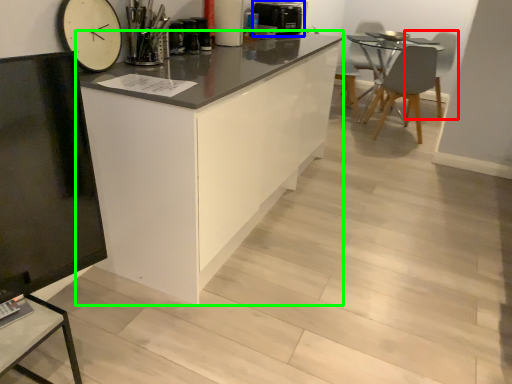
Question: Estimate the real-world distances between objects in this image. Which object is closer to swivel chair (highlighted by a red box), appliance (highlighted by a blue box) or cabinetry (highlighted by a green box)?

Choices:
 (A) appliance
 (B) cabinetry

Answer: (A)